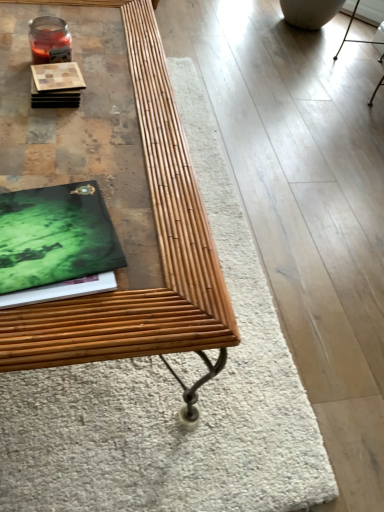
Identify the location of wooden coaster at upper left. (56, 85).

Locate an element on the screen. The width and height of the screenshot is (384, 512). bamboo table at center is located at coordinates (159, 250).

Which is more to the left, green matte book at left or wooden coaster at upper left?

wooden coaster at upper left.

From the image's perspective, is green matte book at left below wooden coaster at upper left?

Indeed, from the image's perspective, green matte book at left is shown beneath wooden coaster at upper left.

Who is more distant, green matte book at left or wooden coaster at upper left?

Positioned behind is wooden coaster at upper left.

In order to click on book above the green matte book at left (from a real-world perspective) in this screenshot , I will do `click(56, 85)`.

Measure the distance from wooden coaster at upper left to green matte book at left.

wooden coaster at upper left and green matte book at left are 14.62 inches apart.

Choose the correct answer: Is wooden coaster at upper left inside green matte book at left or outside it?

wooden coaster at upper left is not enclosed by green matte book at left.

Is wooden coaster at upper left not near green matte book at left?

No, wooden coaster at upper left is not far from green matte book at left.

Is wooden coaster at upper left in front of or behind green matte book at left in the image?

In the image, wooden coaster at upper left appears behind green matte book at left.

Is wooden coaster at upper left shorter than bamboo table at center?

Indeed, wooden coaster at upper left has a lesser height compared to bamboo table at center.

Between wooden coaster at upper left and bamboo table at center, which one has larger width?

bamboo table at center.

This screenshot has width=384, height=512. I want to click on table directly beneath the wooden coaster at upper left (from a real-world perspective), so click(159, 250).

Looking at this image, considering the positions of objects wooden coaster at upper left and bamboo table at center in the image provided, who is more to the left, wooden coaster at upper left or bamboo table at center?

bamboo table at center is more to the left.

From a real-world perspective, between green matte book at left and bamboo table at center, who is vertically higher?

From a 3D spatial view, green matte book at left is above.

Is green matte book at left looking in the opposite direction of bamboo table at center?

Yes, green matte book at left is facing away from bamboo table at center.

This screenshot has width=384, height=512. I want to click on magazine on the right of bamboo table at center, so click(56, 244).

From the image's perspective, who appears lower, green matte book at left or bamboo table at center?

green matte book at left.

From the image's perspective, is bamboo table at center above green matte book at left?

Yes, from the image's perspective, bamboo table at center is over green matte book at left.

Considering the relative positions of bamboo table at center and green matte book at left in the image provided, is bamboo table at center in front of green matte book at left?

That is True.

Considering the relative sizes of bamboo table at center and green matte book at left in the image provided, is bamboo table at center taller than green matte book at left?

Indeed, bamboo table at center has a greater height compared to green matte book at left.

From a real-world perspective, between bamboo table at center and green matte book at left, who is vertically lower?

bamboo table at center, from a real-world perspective.

Measure the distance between bamboo table at center and wooden coaster at upper left.

13.58 inches.

Can you confirm if bamboo table at center is positioned to the right of wooden coaster at upper left?

No, bamboo table at center is not to the right of wooden coaster at upper left.

Is bamboo table at center taller than wooden coaster at upper left?

Correct, bamboo table at center is much taller as wooden coaster at upper left.

Is bamboo table at center bigger than wooden coaster at upper left?

Yes.

Find the location of a particular element. This screenshot has height=512, width=384. book above the green matte book at left (from a real-world perspective) is located at coordinates (56, 85).

Locate an element on the screen. The width and height of the screenshot is (384, 512). book on the left of green matte book at left is located at coordinates (56, 85).

Looking at the image, which one is located closer to wooden coaster at upper left, bamboo table at center or green matte book at left?

bamboo table at center.

Based on their spatial positions, is wooden coaster at upper left or bamboo table at center closer to green matte book at left?

Based on the image, bamboo table at center appears to be nearer to green matte book at left.

Which object lies further to the anchor point bamboo table at center, wooden coaster at upper left or green matte book at left?

wooden coaster at upper left lies further to bamboo table at center than the other object.

Based on their spatial positions, is green matte book at left or bamboo table at center further from wooden coaster at upper left?

green matte book at left is positioned further to the anchor wooden coaster at upper left.

Looking at the image, which one is located closer to bamboo table at center, green matte book at left or wooden coaster at upper left?

Based on the image, green matte book at left appears to be nearer to bamboo table at center.

From the picture: Which object lies nearer to the anchor point green matte book at left, bamboo table at center or wooden coaster at upper left?

bamboo table at center is positioned closer to the anchor green matte book at left.

Locate an element on the screen. The height and width of the screenshot is (512, 384). magazine between bamboo table at center and wooden coaster at upper left along the z-axis is located at coordinates (56, 244).